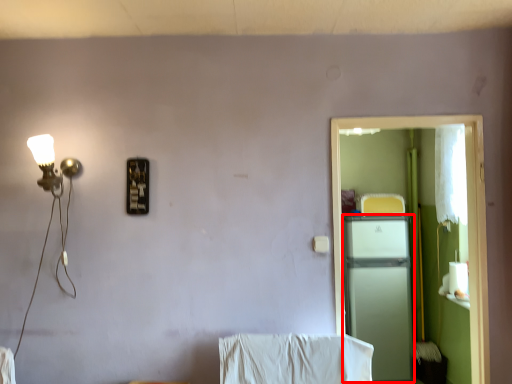
Question: From the image, what is the correct spatial relationship of appliance (annotated by the red box) in relation to screen door?

Choices:
 (A) right
 (B) left

Answer: (A)